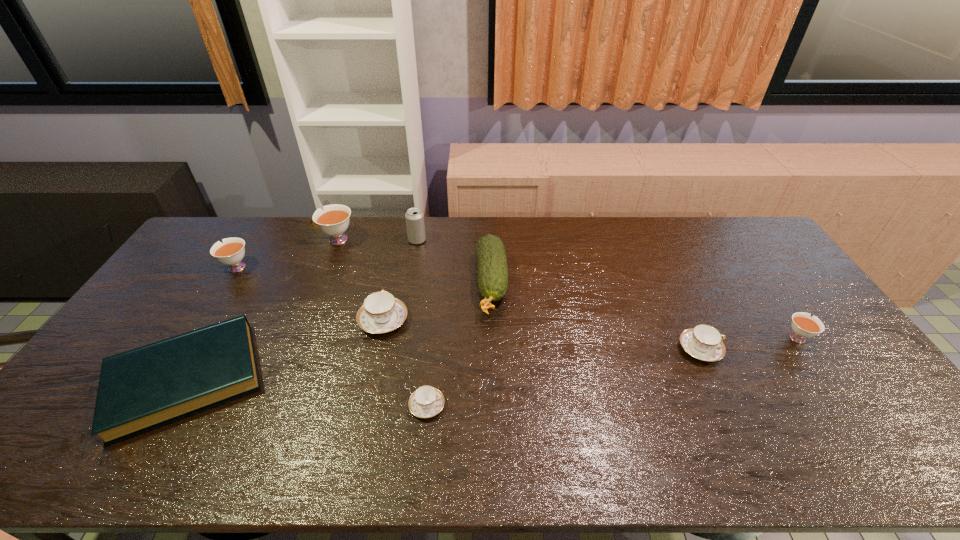
This screenshot has height=540, width=960. What are the coordinates of `vacant space that satisfies the following two spatial constraints: 1. on the side of the beer can with the handle; 2. on the left side of the farthest teacup` in the screenshot? It's located at (336, 240).

This screenshot has height=540, width=960. I want to click on vacant point that satisfies the following two spatial constraints: 1. on the side of the biggest white teacup with the handle; 2. on the right side of the white beer can, so click(336, 240).

Find the location of a particular element. The width and height of the screenshot is (960, 540). vacant space that satisfies the following two spatial constraints: 1. on the side of the second teacup from left to right with the handle; 2. on the front side of the blue book is located at coordinates (280, 380).

The width and height of the screenshot is (960, 540). I want to click on vacant space that satisfies the following two spatial constraints: 1. on the side with the handle of the third teacup from left to right; 2. on the right side of the beer can, so click(x=400, y=240).

I want to click on free point that satisfies the following two spatial constraints: 1. on the side of the second nearest white teacup with the handle; 2. on the right side of the book, so click(x=164, y=380).